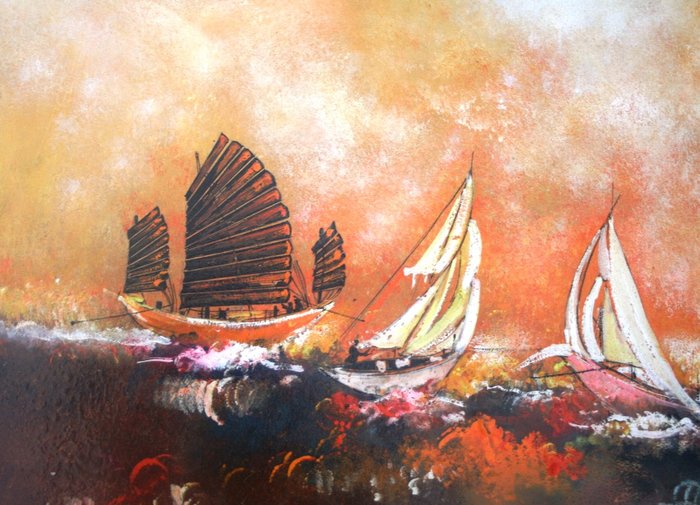
The height and width of the screenshot is (505, 700). Find the location of `foam`. foam is located at coordinates (84, 336), (307, 484).